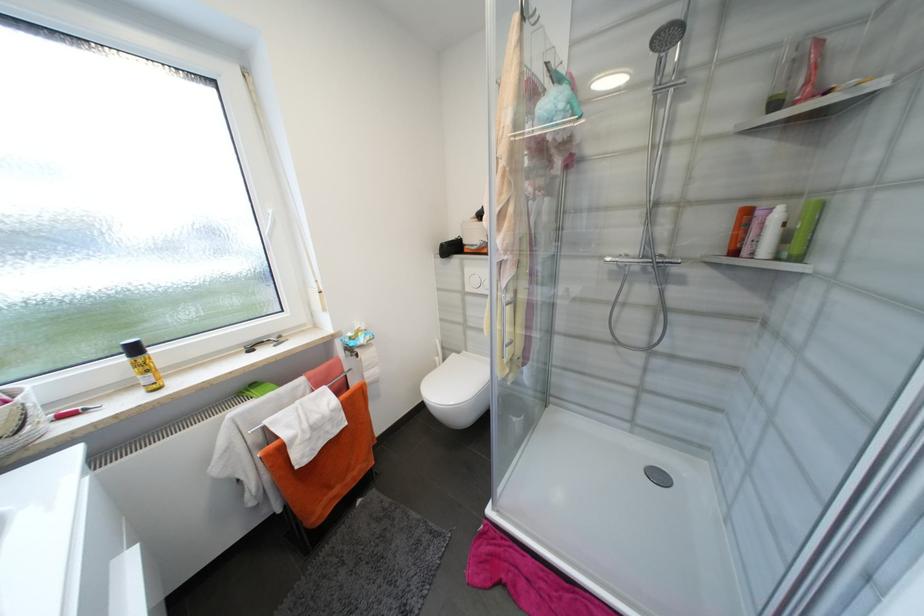
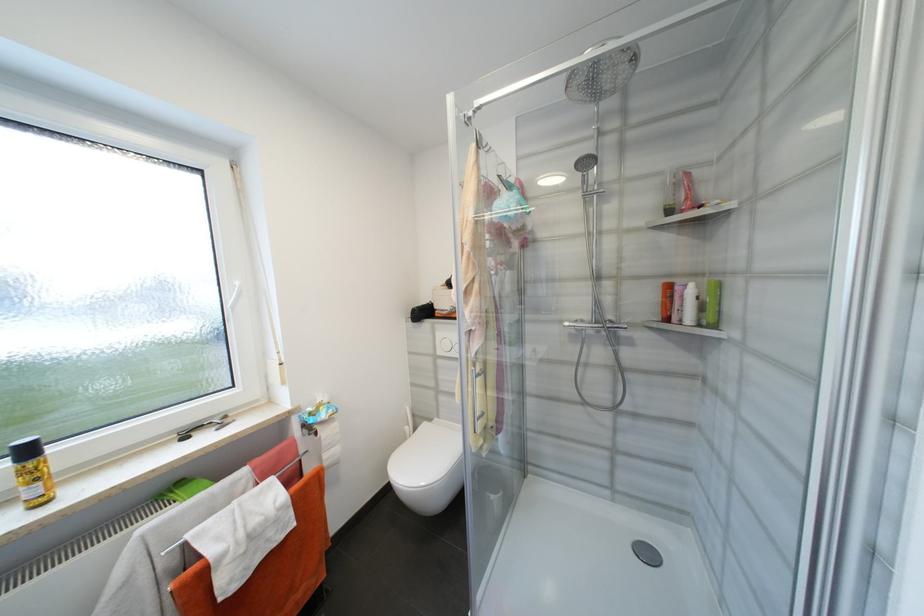
In the second image, find the point that corresponds to point (473, 290) in the first image.

(445, 353)